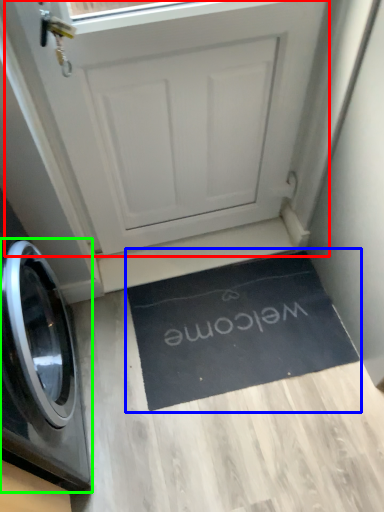
Question: Considering the real-world distances, which object is farthest from screen door (highlighted by a red box)? doormat (highlighted by a blue box) or washing machine (highlighted by a green box)?

Choices:
 (A) doormat
 (B) washing machine

Answer: (B)